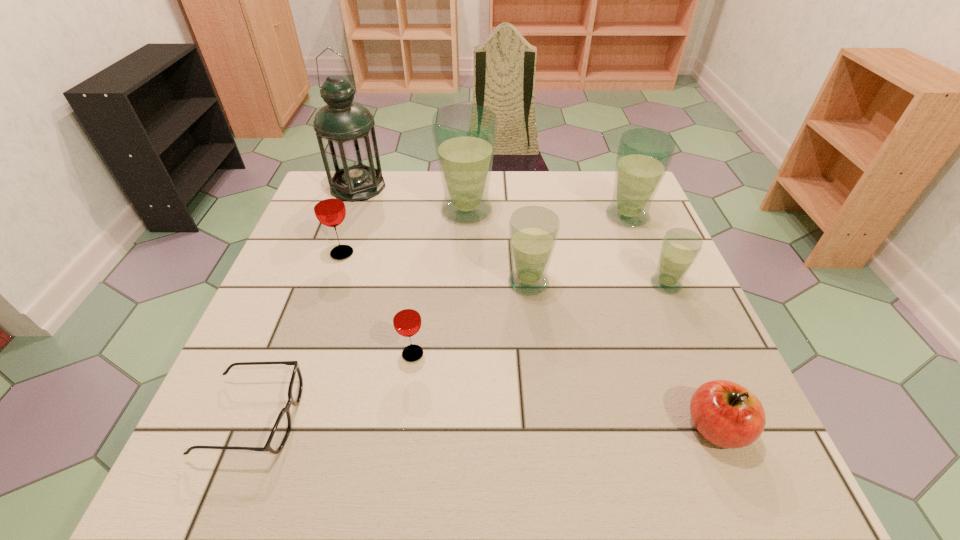
This screenshot has width=960, height=540. Identify the location of vacant space at the near right corner of the desktop. (706, 463).

What are the coordinates of `vacant space that is in between the second biggest blue glass and the left red glass` in the screenshot? It's located at (485, 235).

Where is `unoccupied position between the third biggest blue glass and the biggest blue glass`? Image resolution: width=960 pixels, height=540 pixels. unoccupied position between the third biggest blue glass and the biggest blue glass is located at coordinates click(x=497, y=247).

In order to click on vacant area that lies between the sixth object from left to right and the nearest glass in this screenshot , I will do `click(470, 318)`.

Image resolution: width=960 pixels, height=540 pixels. In order to click on free area in between the bigger red glass and the third biggest blue glass in this screenshot , I will do `click(435, 268)`.

This screenshot has height=540, width=960. I want to click on vacant space in between the shortest object and the smallest blue glass, so point(460,350).

Image resolution: width=960 pixels, height=540 pixels. Identify the location of free spot between the third blue glass from right to left and the right red glass. (470, 318).

You are a GUI agent. You are given a task and a screenshot of the screen. Output one action in this format:
    pyautogui.click(x=<x>, y=<y>)
    Task: Click on the vacant area that lies between the oil lamp and the second blue glass from left to right
    
    Given the screenshot: What is the action you would take?
    pyautogui.click(x=444, y=234)

Find the location of a particular element. The height and width of the screenshot is (540, 960). vacant region between the second blue glass from left to right and the second biggest blue glass is located at coordinates 578,249.

You are a GUI agent. You are given a task and a screenshot of the screen. Output one action in this format:
    pyautogui.click(x=<x>, y=<y>)
    Task: Click on the free space between the second biggest blue glass and the smallest blue glass
    
    Given the screenshot: What is the action you would take?
    pyautogui.click(x=647, y=251)